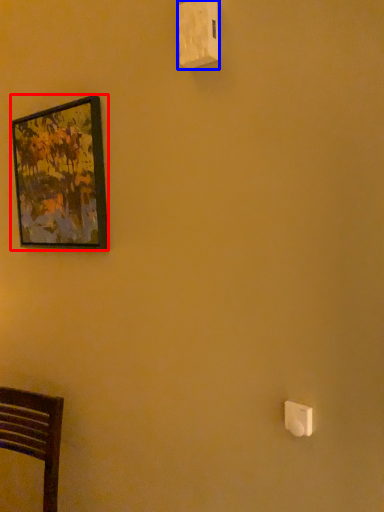
Question: Which object is further to the camera taking this photo, picture frame (highlighted by a red box) or light switch (highlighted by a blue box)?

Choices:
 (A) picture frame
 (B) light switch

Answer: (A)